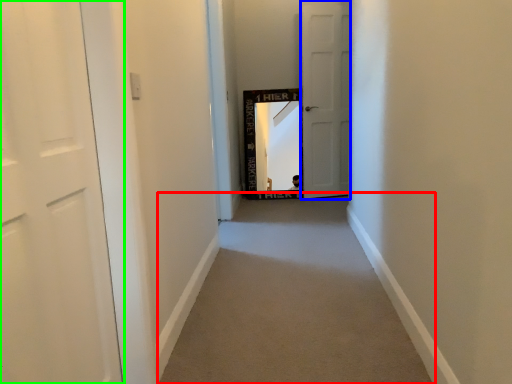
Question: Considering the real-world distances, which object is closest to alley (highlighted by a red box)? door (highlighted by a blue box) or door (highlighted by a green box).

Choices:
 (A) door
 (B) door

Answer: (B)